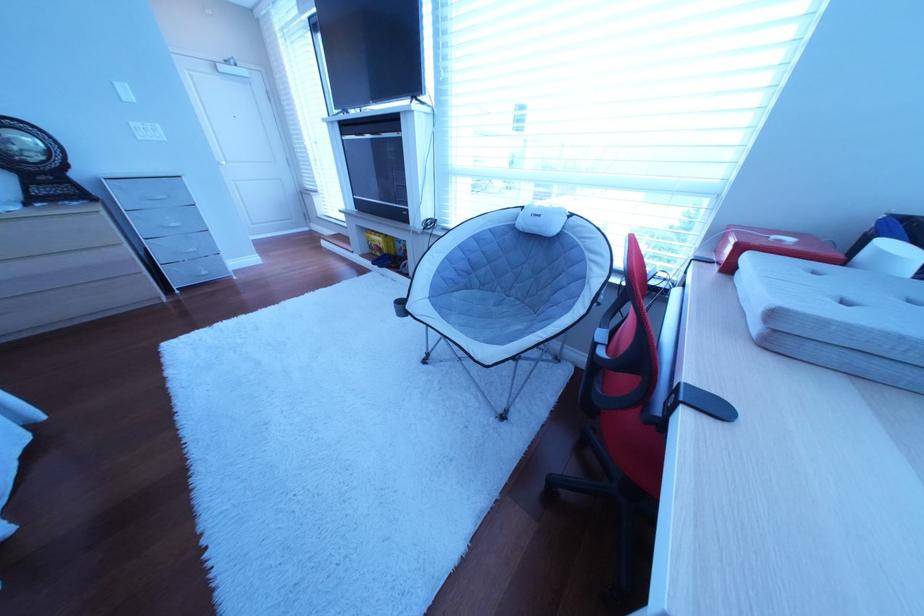
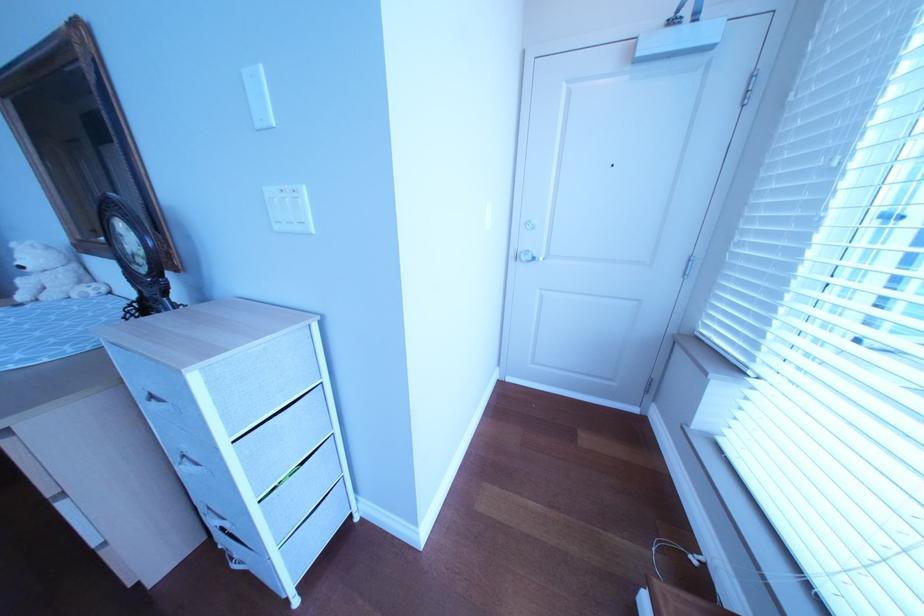
Locate, in the second image, the point that corresponds to pixel 155 140 in the first image.

(292, 229)